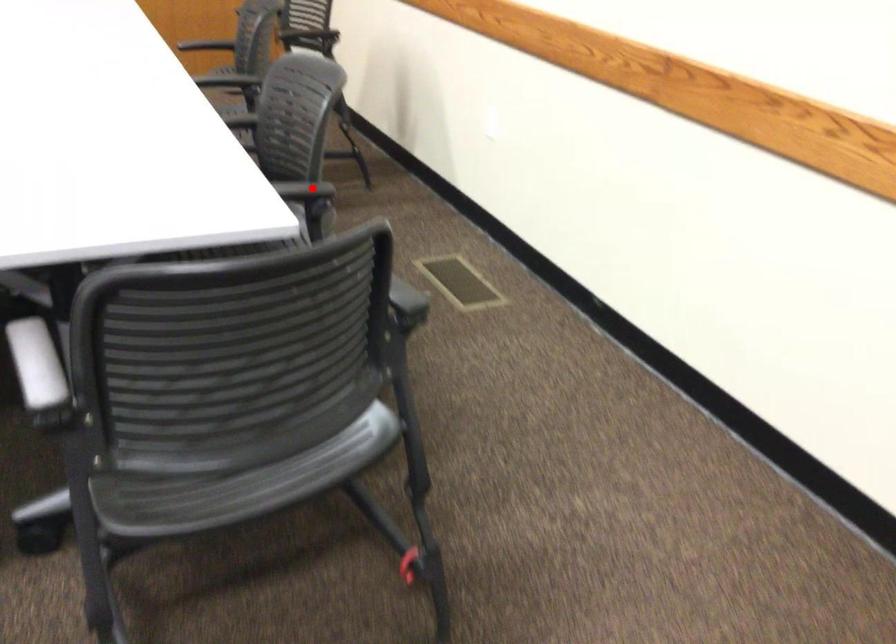
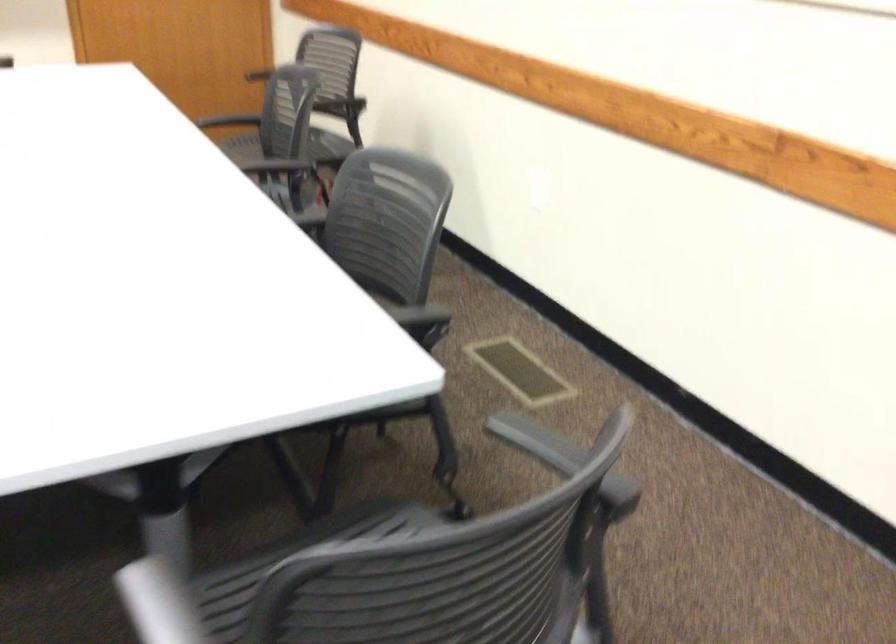
In the second image, find the point that corresponds to the highlighted location in the first image.

(419, 315)